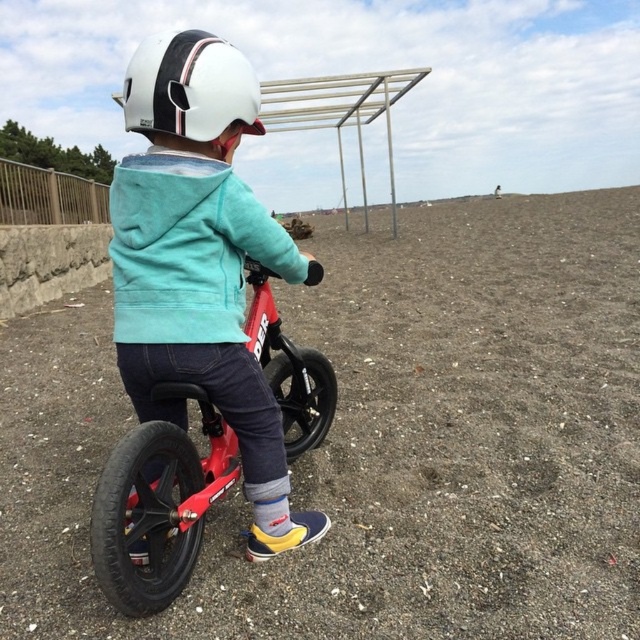
Question: Which of the following is the farthest from the observer?

Choices:
 (A) (147, 637)
 (B) (147, 131)
 (C) (179, 502)

Answer: (C)

Question: Which object is positioned closest to the dull brown dirt at center?

Choices:
 (A) white matte helmet at upper center
 (B) shiny red bicycle at center

Answer: (B)

Question: Is dull brown dirt at center positioned in front of shiny red bicycle at center?

Choices:
 (A) no
 (B) yes

Answer: (A)

Question: Which point is closer to the camera?

Choices:
 (A) white matte helmet at upper center
 (B) dull brown dirt at center
 (C) shiny red bicycle at center

Answer: (C)

Question: Does dull brown dirt at center appear under shiny red bicycle at center?

Choices:
 (A) yes
 (B) no

Answer: (B)

Question: Is dull brown dirt at center positioned behind shiny red bicycle at center?

Choices:
 (A) no
 (B) yes

Answer: (B)